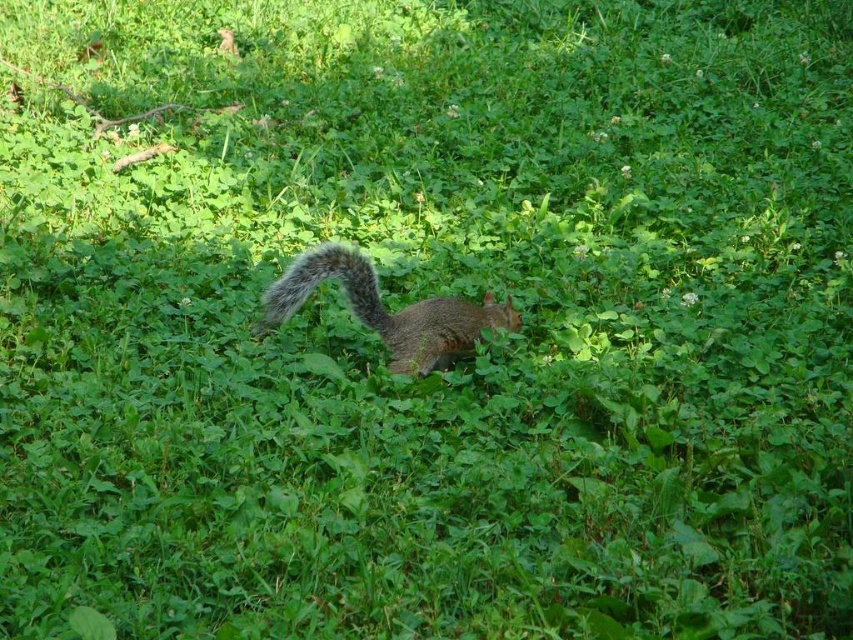
Question: Which point appears farthest from the camera in this image?

Choices:
 (A) (337, 244)
 (B) (399, 371)

Answer: (A)

Question: Observing the image, what is the correct spatial positioning of gray-furred squirrel at center in reference to fuzzy gray tail at center?

Choices:
 (A) below
 (B) above

Answer: (A)

Question: Which point appears closest to the camera in this image?

Choices:
 (A) (363, 268)
 (B) (381, 326)

Answer: (A)

Question: Does gray-furred squirrel at center have a greater width compared to fuzzy gray tail at center?

Choices:
 (A) yes
 (B) no

Answer: (A)

Question: Is gray-furred squirrel at center to the right of fuzzy gray tail at center from the viewer's perspective?

Choices:
 (A) no
 (B) yes

Answer: (B)

Question: Which object appears farthest from the camera in this image?

Choices:
 (A) fuzzy gray tail at center
 (B) gray-furred squirrel at center

Answer: (B)